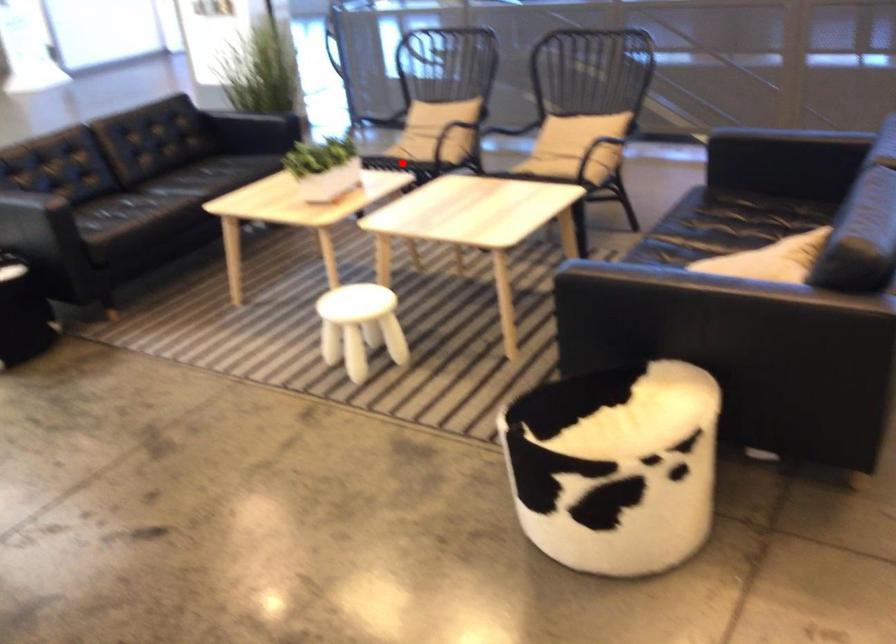
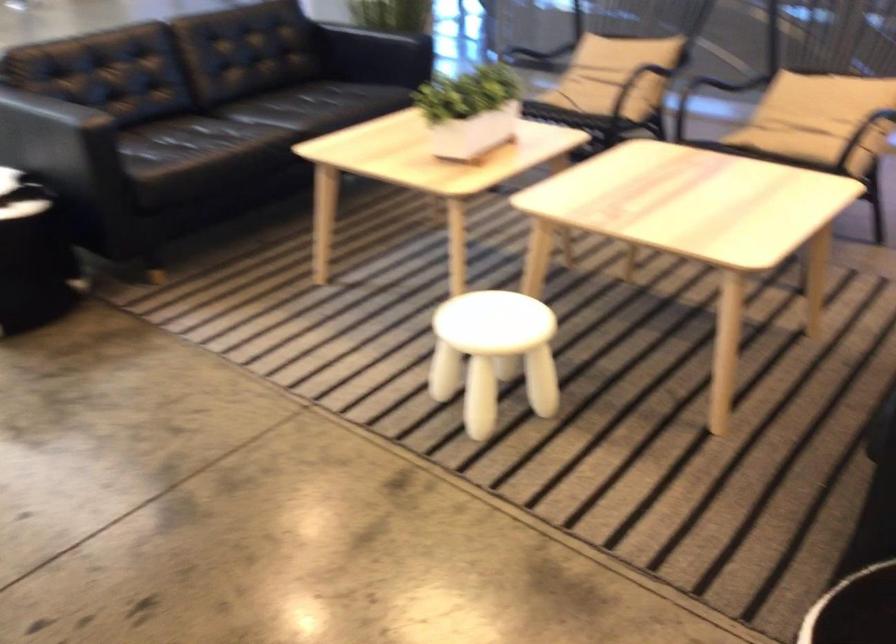
Question: I am providing you with two images of the same scene from different viewpoints. A red point is marked on the first image. At the location where the point appears in image 1, is it still visible in image 2?

Choices:
 (A) Yes
 (B) No

Answer: (B)